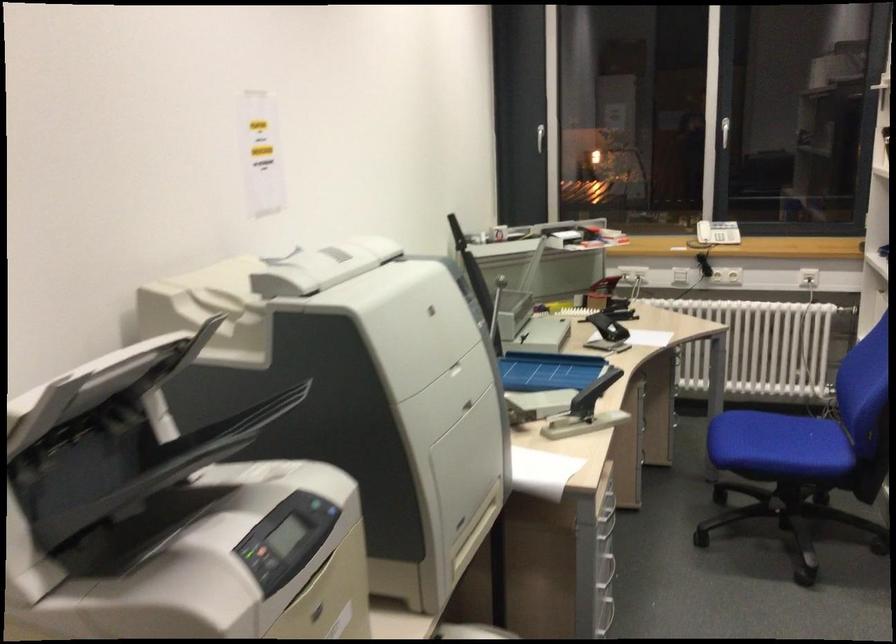
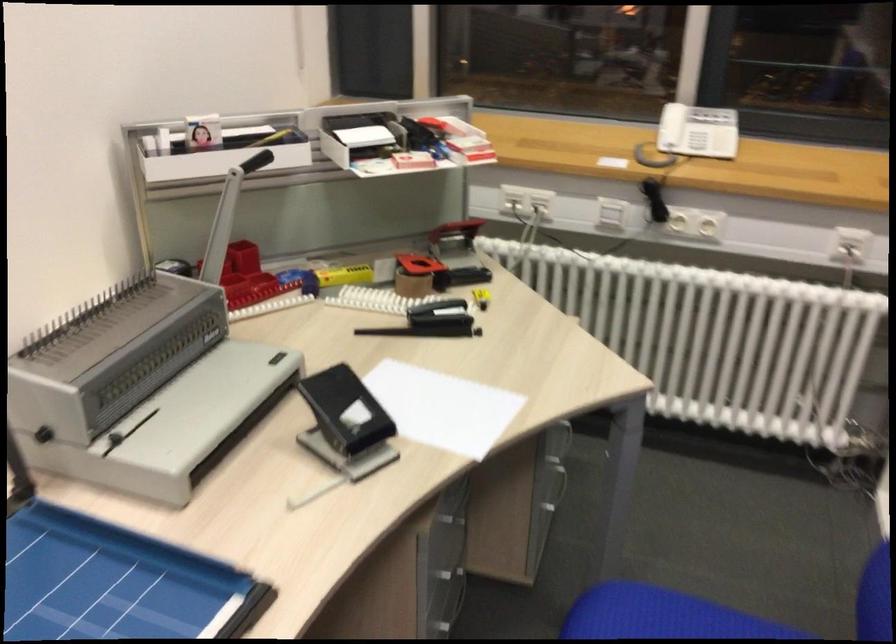
Locate, in the second image, the point that corresponds to (785,421) in the first image.

(713, 611)